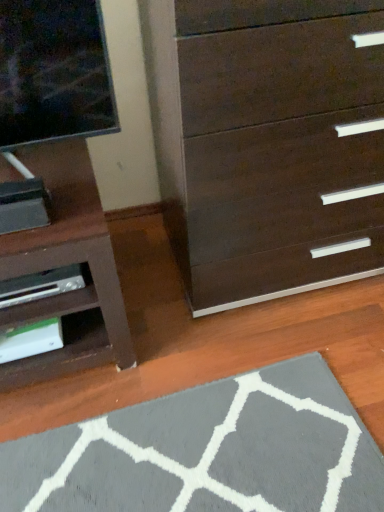
This screenshot has height=512, width=384. What are the coordinates of `gray soft rug at lower center` in the screenshot? It's located at (208, 451).

The image size is (384, 512). What do you see at coordinates (208, 451) in the screenshot?
I see `gray soft rug at lower center` at bounding box center [208, 451].

Where is `gray soft rug at lower center`? The image size is (384, 512). gray soft rug at lower center is located at coordinates [x=208, y=451].